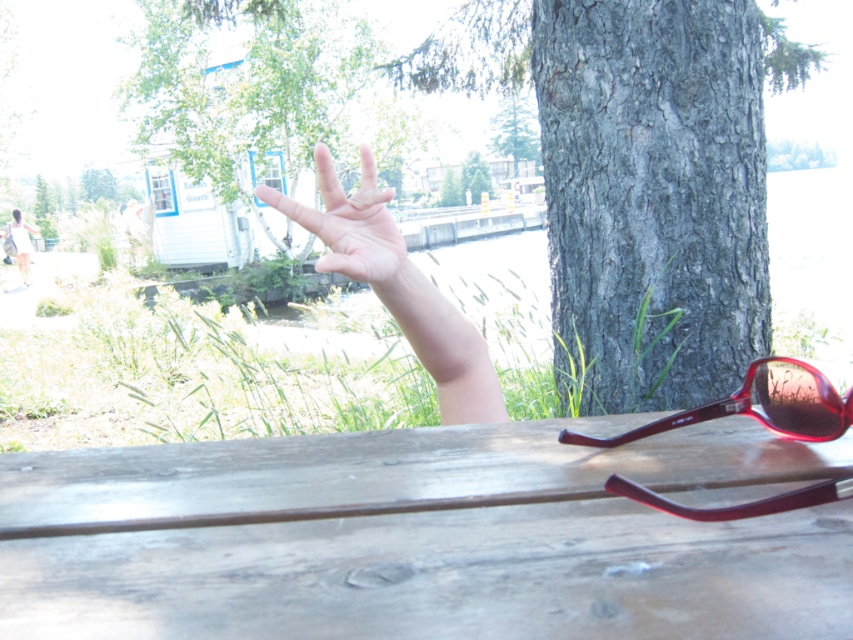
Can you confirm if green rough bark tree at upper center is shorter than pale skin hand at center?

Incorrect, green rough bark tree at upper center's height does not fall short of pale skin hand at center's.

Can you confirm if green rough bark tree at upper center is wider than pale skin hand at center?

Yes.

Measure the distance between green rough bark tree at upper center and camera.

green rough bark tree at upper center is 31.00 inches from camera.

Locate an element on the screen. Image resolution: width=853 pixels, height=640 pixels. green rough bark tree at upper center is located at coordinates (248, 93).

Does shiny red plastic sunglasses at lower right appear under pale skin hand at center?

Answer: Indeed, shiny red plastic sunglasses at lower right is positioned under pale skin hand at center.

Can you confirm if shiny red plastic sunglasses at lower right is positioned to the right of pale skin hand at center?

Indeed, shiny red plastic sunglasses at lower right is positioned on the right side of pale skin hand at center.

Between point (798, 499) and point (383, 212), which one is positioned in front?

Point (798, 499) is in front.

Find the location of a particular element. Image resolution: width=853 pixels, height=640 pixels. shiny red plastic sunglasses at lower right is located at coordinates (759, 404).

Which is behind, point (770, 380) or point (16, 221)?

Positioned behind is point (16, 221).

You are a GUI agent. You are given a task and a screenshot of the screen. Output one action in this format:
    pyautogui.click(x=<x>, y=<y>)
    Task: Click on the shiny red plastic sunglasses at lower right
    The image size is (853, 640).
    Given the screenshot: What is the action you would take?
    pyautogui.click(x=759, y=404)